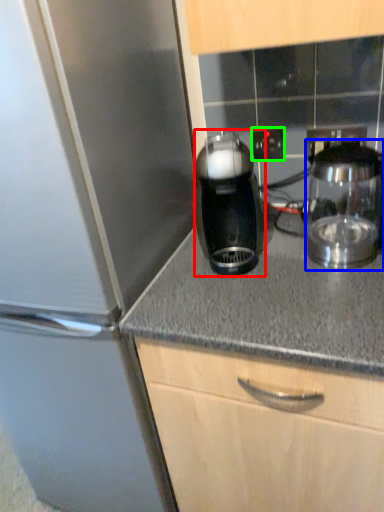
Question: Estimate the real-world distances between objects in this image. Which object is farther from kitchen appliance (highlighted by a red box), kitchen appliance (highlighted by a blue box) or electric outlet (highlighted by a green box)?

Choices:
 (A) kitchen appliance
 (B) electric outlet

Answer: (B)